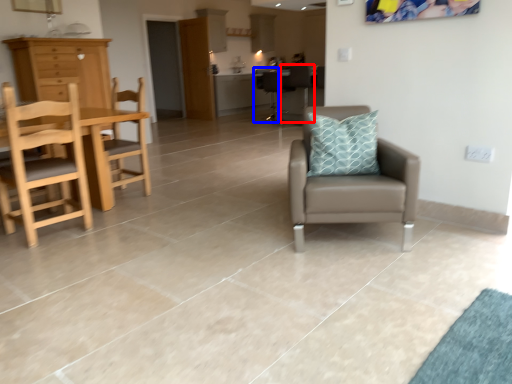
Question: Which object appears closest to the camera in this image, chair (highlighted by a red box) or armchair (highlighted by a blue box)?

Choices:
 (A) chair
 (B) armchair

Answer: (A)